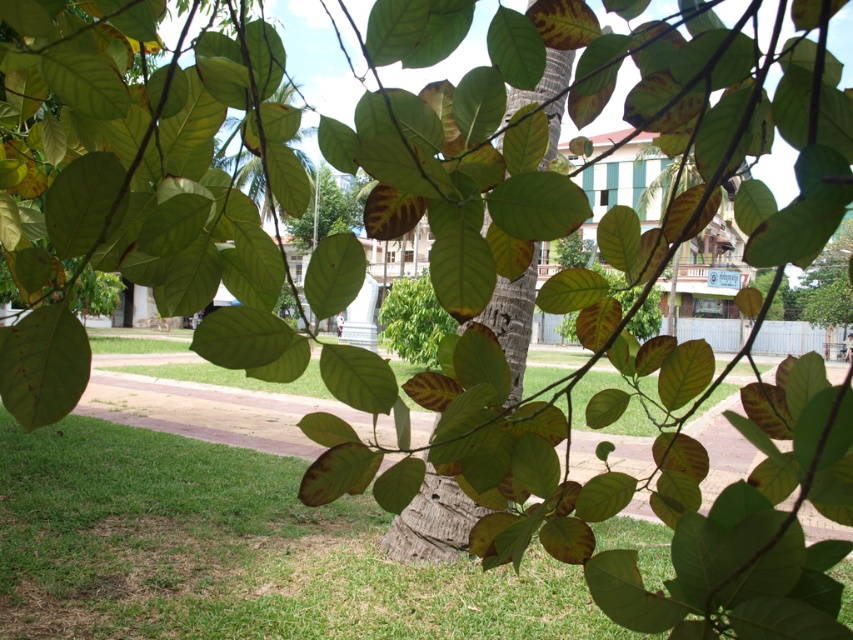
Based on the photo, you are standing at the edge of the green grass at lower left and want to walk towards the brown rough tree trunk at center. Which direction should you move to reach it?

The green grass at lower left is positioned on the left side of brown rough tree trunk at center, so to reach the tree trunk, you should move to the right.

You are standing at point (529, 292) and want to walk to the building with the red roof. Which direction should you go relative to point (100, 509)?

Since point (100, 509) is behind point (529, 292), you should walk towards the direction of point (100, 509) to reach the building with the red roof.

You are standing on the green grass at lower left and want to walk towards the brown rough tree trunk at center. Is the tree trunk closer to you or further away compared to where you are standing?

The brown rough tree trunk at center is further away from you than the green grass at lower left, so you have to walk forward to reach it.